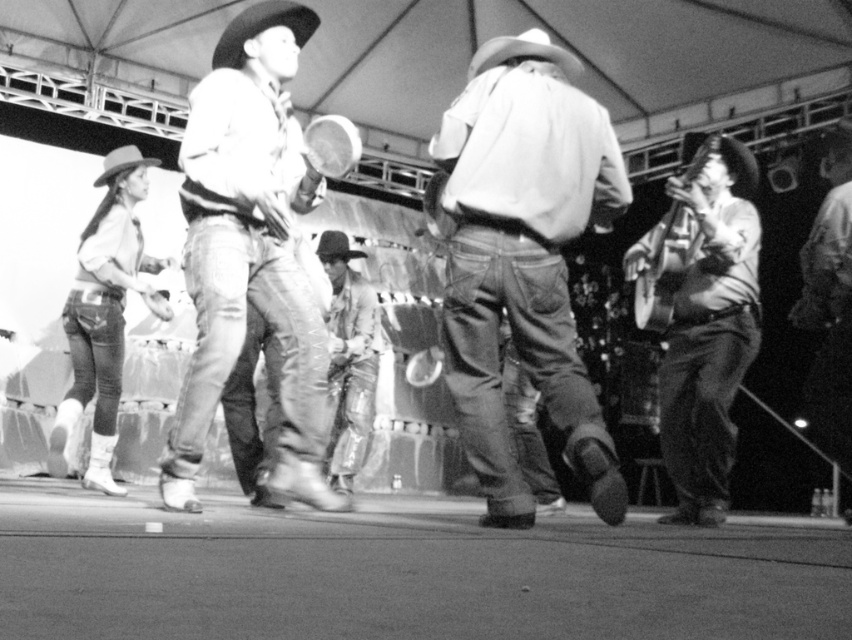
Between rustic leather guitar at right and leather cowboy boots at center, which one appears on the left side from the viewer's perspective?

leather cowboy boots at center is more to the left.

Can you confirm if rustic leather guitar at right is positioned above leather cowboy boots at center?

Yes.

This screenshot has height=640, width=852. Find the location of `rustic leather guitar at right`. rustic leather guitar at right is located at coordinates point(701,317).

Does denim jeans at center appear under rustic leather guitar at right?

No.

Can you confirm if denim jeans at center is positioned to the left of rustic leather guitar at right?

Indeed, denim jeans at center is positioned on the left side of rustic leather guitar at right.

Is point (279, 100) positioned after point (723, 173)?

No.

Locate an element on the screen. denim jeans at center is located at coordinates point(250,252).

The width and height of the screenshot is (852, 640). Describe the element at coordinates (524, 259) in the screenshot. I see `ripped denim jeans at center` at that location.

Does ripped denim jeans at center have a lesser width compared to denim jeans at center?

Incorrect, ripped denim jeans at center's width is not less than denim jeans at center's.

Find the location of a particular element. This screenshot has height=640, width=852. ripped denim jeans at center is located at coordinates (524, 259).

I want to click on ripped denim jeans at center, so click(524, 259).